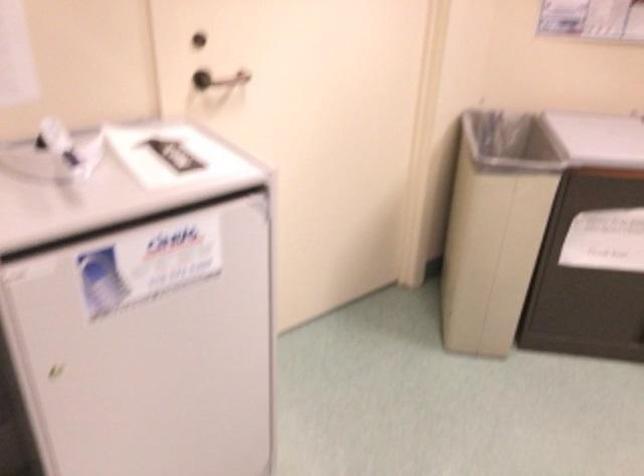
You are a GUI agent. You are given a task and a screenshot of the screen. Output one action in this format:
    pyautogui.click(x=<x>, y=<y>)
    Task: Click on the door handle
    This screenshot has height=476, width=644.
    Given the screenshot: What is the action you would take?
    pos(216,79)